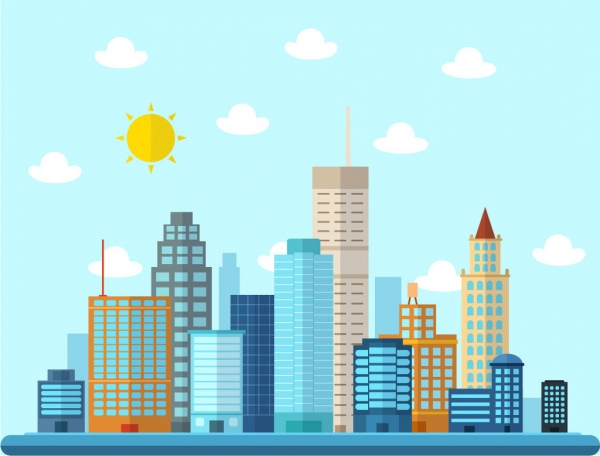
Identify the location of doors. (553, 427), (506, 428), (467, 427), (418, 421), (381, 424), (338, 428), (307, 425), (213, 427), (125, 423), (60, 422).